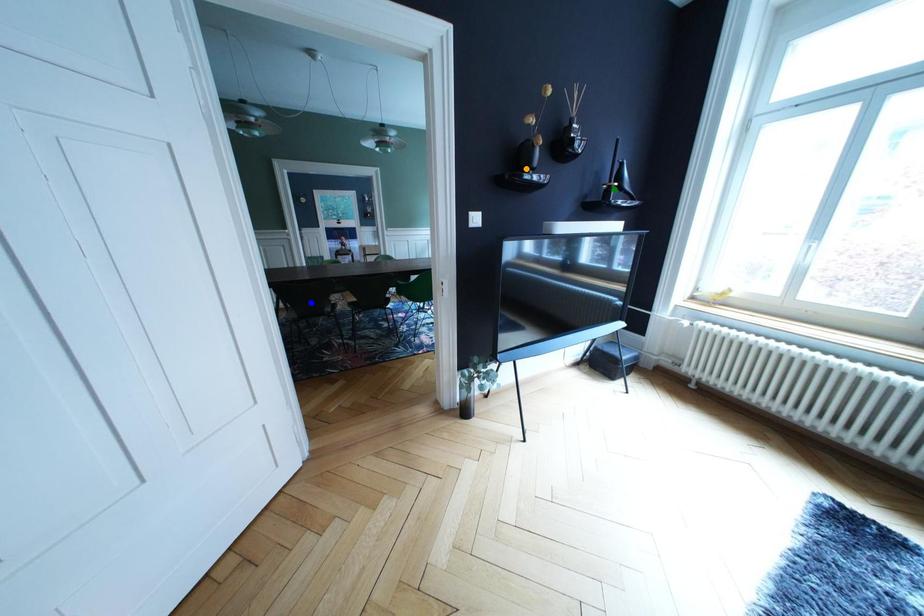
Order these from farthest to nearest:
A) blue point
B) orange point
C) green point

blue point < green point < orange point